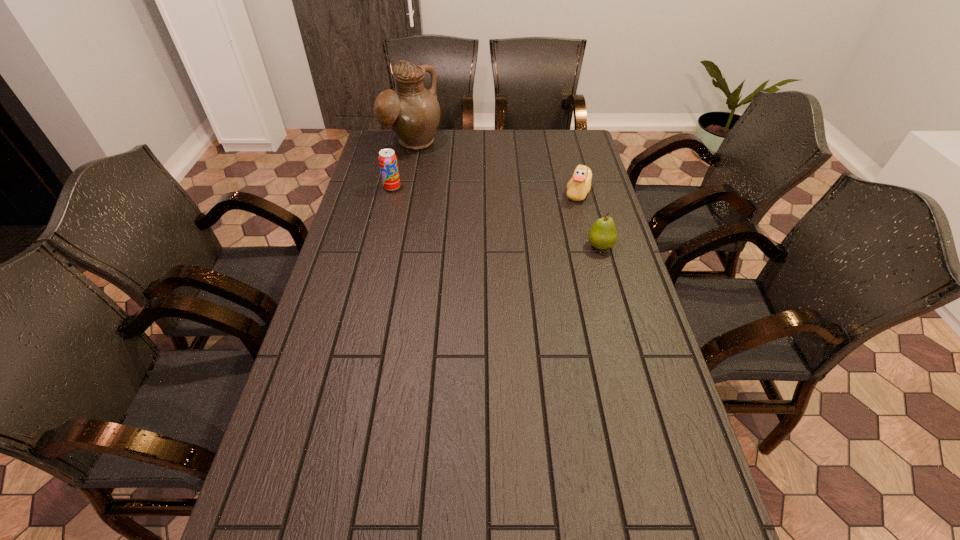
You are a GUI agent. You are given a task and a screenshot of the screen. Output one action in this format:
    pyautogui.click(x=<x>, y=<y>)
    Task: Click on the free space between the tallest object and the soda can
    
    Given the screenshot: What is the action you would take?
    pyautogui.click(x=402, y=166)

This screenshot has width=960, height=540. In order to click on free spot between the soda can and the tallest object in this screenshot , I will do `click(402, 166)`.

At what (x,y) coordinates should I click in order to perform the action: click on blank region between the duck and the nearest object. Please return your answer as a coordinate pair (x, y). Image resolution: width=960 pixels, height=540 pixels. Looking at the image, I should click on (589, 219).

Find the location of a particular element. free space between the pitcher and the soda can is located at coordinates (402, 166).

In order to click on object that is the nearest to the pear in this screenshot , I will do `click(579, 185)`.

Identify which object is located as the nearest to the duck. Please provide its 2D coordinates. Your answer should be formatted as a tuple, i.e. [(x, y)], where the tuple contains the x and y coordinates of a point satisfying the conditions above.

[(603, 235)]

Locate an element on the screen. vacant space that satisfies the following two spatial constraints: 1. on the front side of the farthest object; 2. on the right side of the duck is located at coordinates (403, 192).

Where is `vacant space that satisfies the following two spatial constraints: 1. on the front side of the soda can; 2. on the left side of the duck`? vacant space that satisfies the following two spatial constraints: 1. on the front side of the soda can; 2. on the left side of the duck is located at coordinates (392, 192).

Find the location of `free spot that satisfies the following two spatial constraints: 1. on the front side of the soda can; 2. on the left side of the pear`. free spot that satisfies the following two spatial constraints: 1. on the front side of the soda can; 2. on the left side of the pear is located at coordinates pyautogui.click(x=378, y=246).